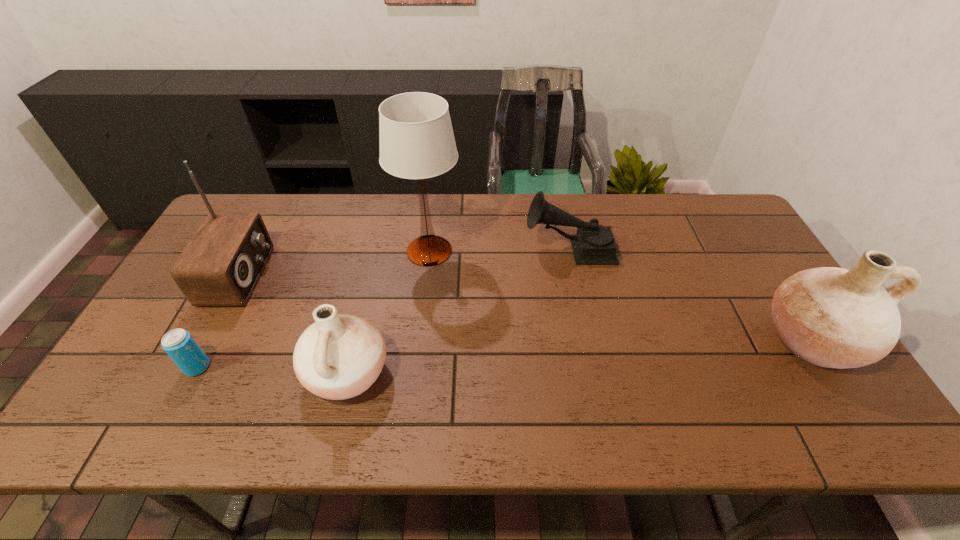
Find the location of `soda can present at the left edge`. soda can present at the left edge is located at coordinates (179, 344).

Where is `object located in the right edge section of the desktop`? This screenshot has height=540, width=960. object located in the right edge section of the desktop is located at coordinates (831, 317).

Find the location of `object present at the near left corner`. object present at the near left corner is located at coordinates (179, 344).

Find the location of a particular element. object that is positioned at the near right corner is located at coordinates point(831,317).

Find the location of `blank area at the far edge`. blank area at the far edge is located at coordinates (576, 200).

Where is `vacant position at the near edge of the desktop`? vacant position at the near edge of the desktop is located at coordinates (233, 368).

At what (x,y) coordinates should I click in order to perform the action: click on free space at the far left corner. Please return your answer as a coordinate pair (x, y). The image size is (960, 540). Looking at the image, I should click on pyautogui.click(x=261, y=208).

The image size is (960, 540). Find the location of `vacant position at the far right corner of the desktop`. vacant position at the far right corner of the desktop is located at coordinates (709, 235).

Find the location of a particular element. This screenshot has height=540, width=960. vacant space at the near right corner of the desktop is located at coordinates (775, 375).

Where is `free spot between the radio receiver and the rightmost object`? The height and width of the screenshot is (540, 960). free spot between the radio receiver and the rightmost object is located at coordinates (525, 308).